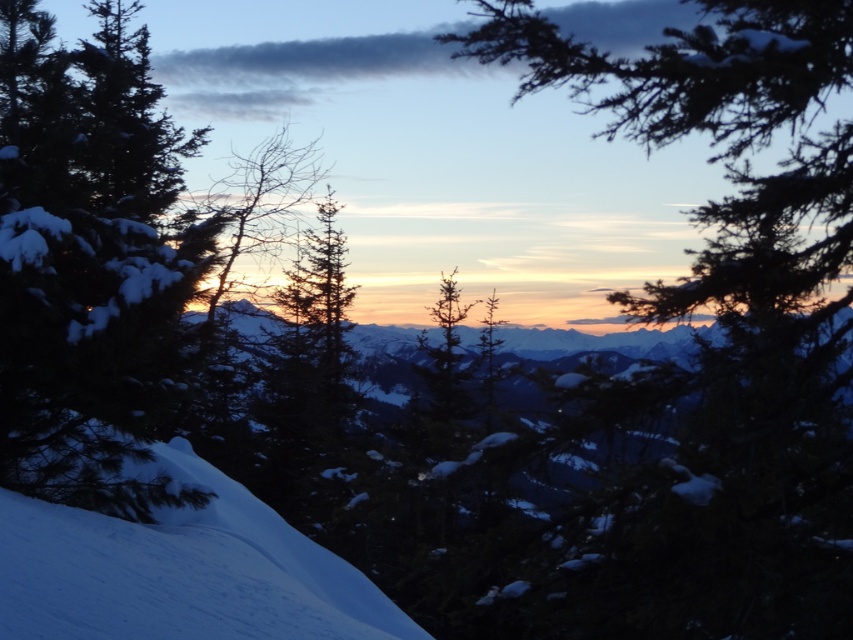
Question: Among these points, which one is nearest to the camera?

Choices:
 (A) (625, 115)
 (B) (48, 269)

Answer: (A)

Question: Can you confirm if green matte tree at upper right is positioned above snow-covered evergreen at left?

Choices:
 (A) no
 (B) yes

Answer: (A)

Question: Which object appears closest to the camera in this image?

Choices:
 (A) snow-covered evergreen at left
 (B) green matte tree at upper right
 (C) white snow at lower left

Answer: (C)

Question: Does green matte tree at upper right appear on the left side of white snow at lower left?

Choices:
 (A) no
 (B) yes

Answer: (A)

Question: Considering the real-world distances, which object is farthest from the green matte tree at upper right?

Choices:
 (A) snow-covered evergreen at left
 (B) white snow at lower left

Answer: (A)

Question: Considering the relative positions of snow-covered evergreen at left and white snow at lower left in the image provided, where is snow-covered evergreen at left located with respect to white snow at lower left?

Choices:
 (A) above
 (B) below

Answer: (A)